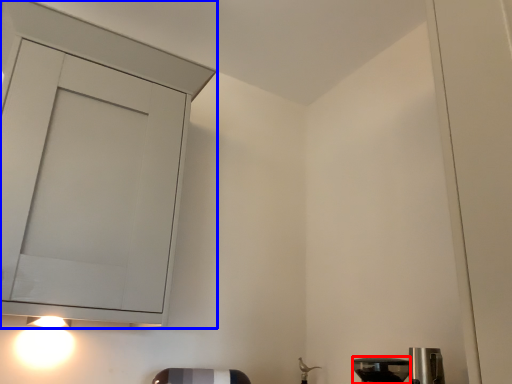
Question: Among these objects, which one is nearest to the camera, appliance (highlighted by a red box) or cabinetry (highlighted by a blue box)?

Choices:
 (A) appliance
 (B) cabinetry

Answer: (B)